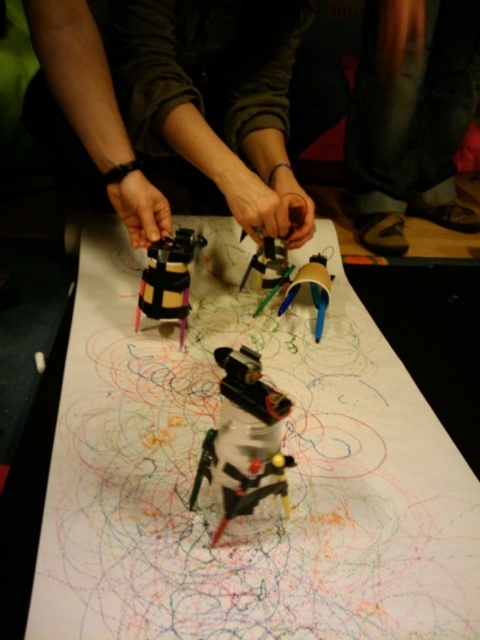
You are an artist trying to place a matte plastic cup at center on the table without covering the white paper at center. Based on the scene, is this possible?

The white paper at center is in front of the matte plastic cup at center, so placing the matte plastic cup at center on the table would cover the white paper at center. Therefore, it is not possible to place the matte plastic cup at center without covering the white paper at center.

You are an artist trying to position a new ink bot on the table. The white paper at center is located at point [264,500]. Where should you place the new ink bot so that it is on the same horizontal line as the white paper at center?

The white paper at center is located at point [264,500], so to place the new ink bot on the same horizontal line, it should be placed at any coordinate with the same y value of 0.552. For example, placing it at point 0.6, 0.552 would be on the same horizontal line as the white paper at center.

You are an engineer observing the ink bots on the table. You need to place a matte plastic cup at center on top of the metallic plastic robot at center. Will the cup fit properly?

The metallic plastic robot at center is wider than the matte plastic cup at center, so the cup should fit properly on top since its base is narrower than the robot.